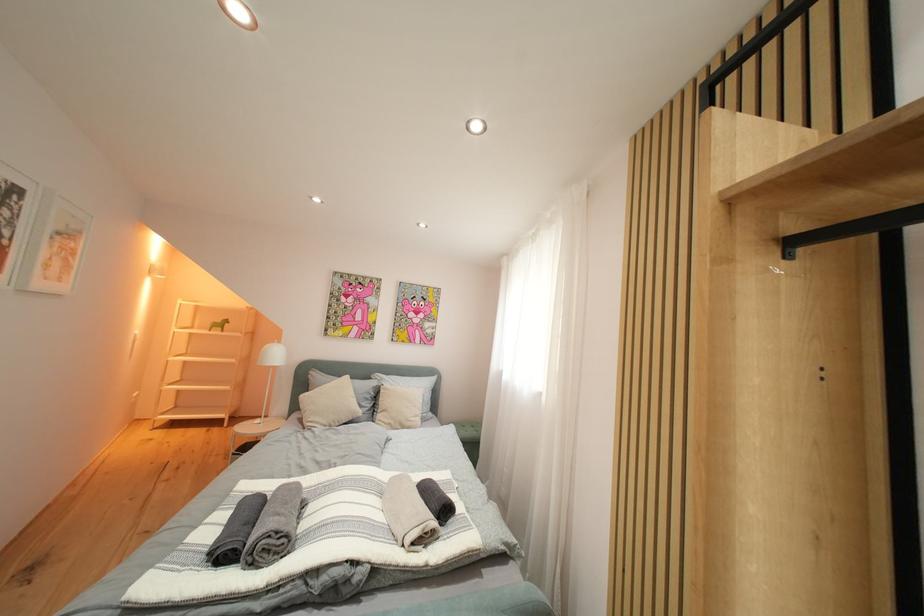
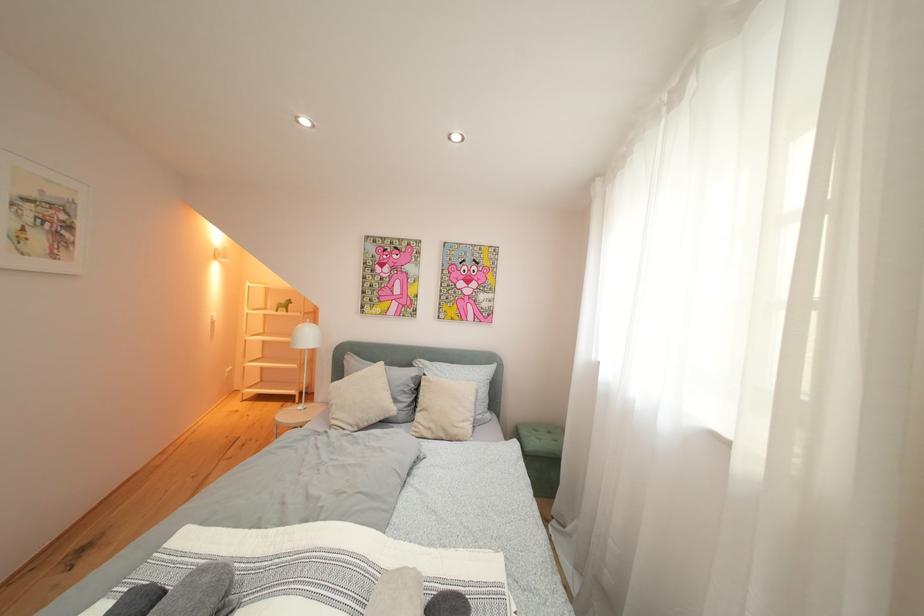
Question: In a continuous first-person perspective shot, in which direction is the camera moving?

Choices:
 (A) Left
 (B) Right
 (C) Forward
 (D) Backward

Answer: (C)